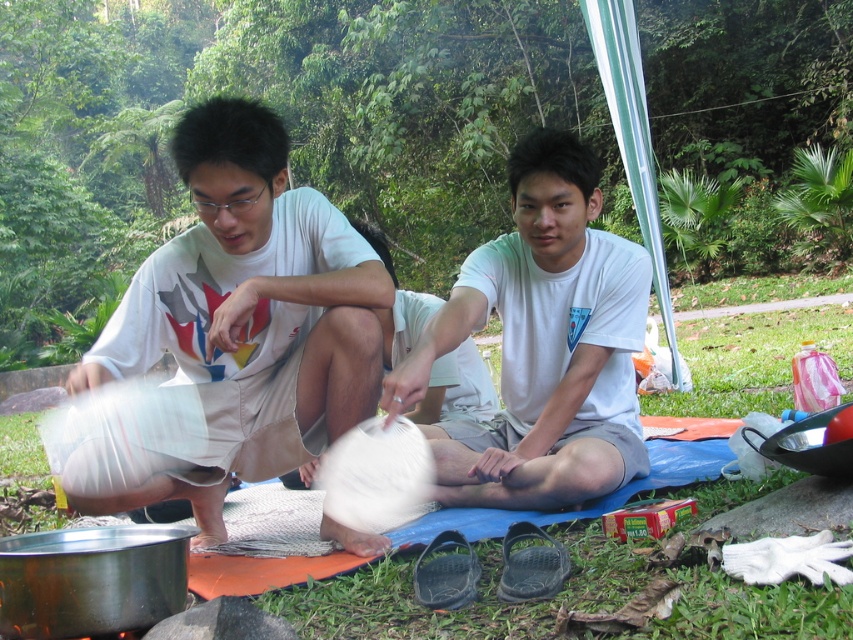
Measure the distance between point (358, 305) and camera.

Point (358, 305) is 7.02 feet from camera.

Based on the photo, does white cotton shirt at left lie behind white cotton shirt at center?

No, white cotton shirt at left is closer to the viewer.

Measure the distance between point (221, 416) and camera.

Point (221, 416) and camera are 2.34 meters apart.

Where is `white cotton shirt at left`? The width and height of the screenshot is (853, 640). white cotton shirt at left is located at coordinates (241, 323).